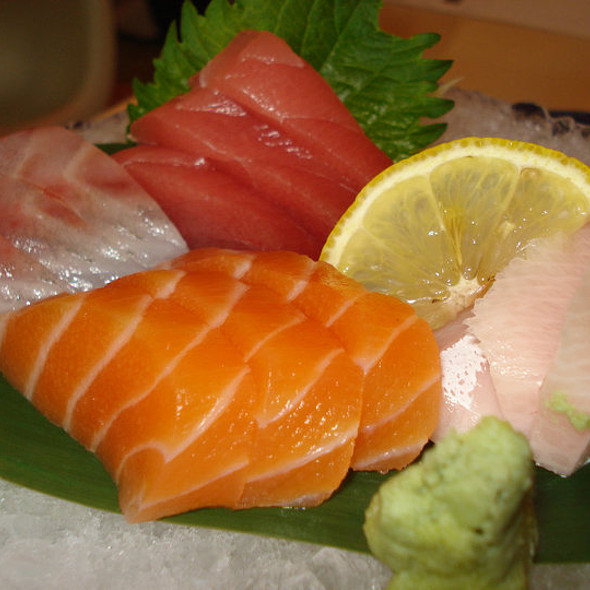
Locate an element on the screen. countertop is located at coordinates (58, 560).